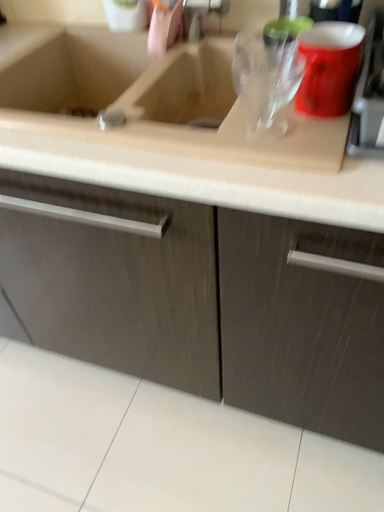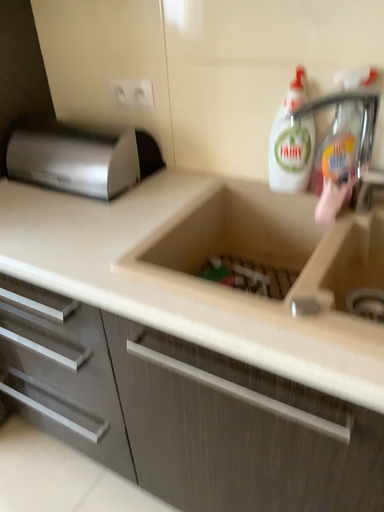
Question: Which way did the camera rotate in the video?

Choices:
 (A) rotated left
 (B) rotated right

Answer: (A)